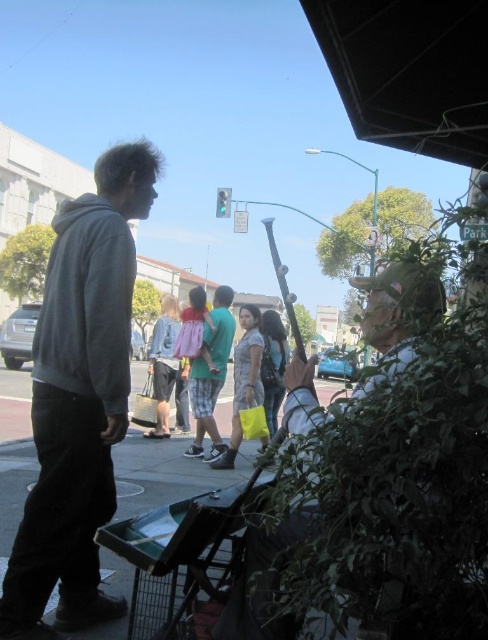
You are a delivery person carrying a large metallic silver cart at center. You need to pass by the gray hoodie at left. Can you safely maneuver around them without the cart hitting the person?

The gray hoodie at left is smaller than the metallic silver cart at center, so yes, you can safely maneuver around them without the cart hitting the person.

You are a photographer trying to capture both the gray hoodie at left and the leather jacket at center in a single frame. Which clothing item should you focus on first to ensure both are in the frame?

The gray hoodie at left is larger in size than the leather jacket at center, so you should focus on the gray hoodie at left first to ensure both are in the frame since it takes up more space.

You are a fashion designer observing the street scene. You notice two individuals wearing jackets. The first is wearing a gray hoodie at left, and the second is wearing a leather jacket at center. Which jacket appears to be thicker in the image?

The gray hoodie at left is thinner than the leather jacket at center, so the leather jacket at center is thicker.